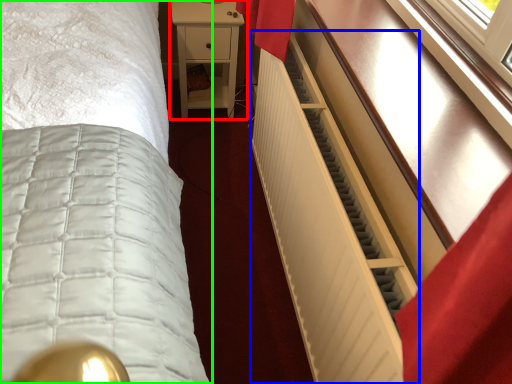
Question: Considering the real-world distances, which object is closest to nightstand (highlighted by a red box)? radiator (highlighted by a blue box) or bed (highlighted by a green box).

Choices:
 (A) radiator
 (B) bed

Answer: (B)